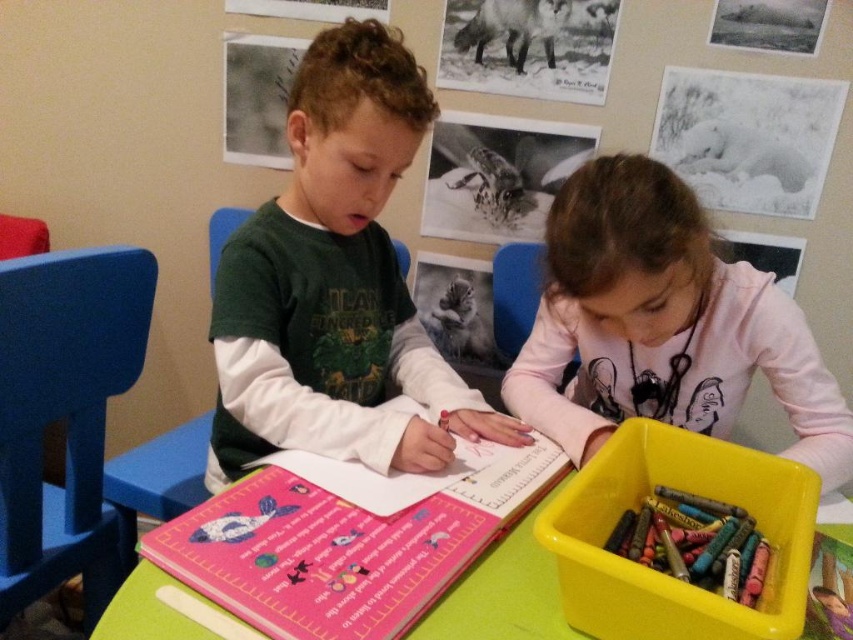
You are a tailor measuring shirts for a school uniform order. You have a green matte shirt at center and a pink cotton shirt at center in front of you. Which shirt has a larger width according to the measurements?

The green matte shirt at center has a larger width than the pink cotton shirt at center.

You are a teacher observing two children at a table. You notice the green matte shirt at center and the pink cotton shirt at center. Which child is sitting closer to the front of the table?

The green matte shirt at center is located above the pink cotton shirt at center, meaning the child wearing the green matte shirt at center is sitting closer to the front of the table.